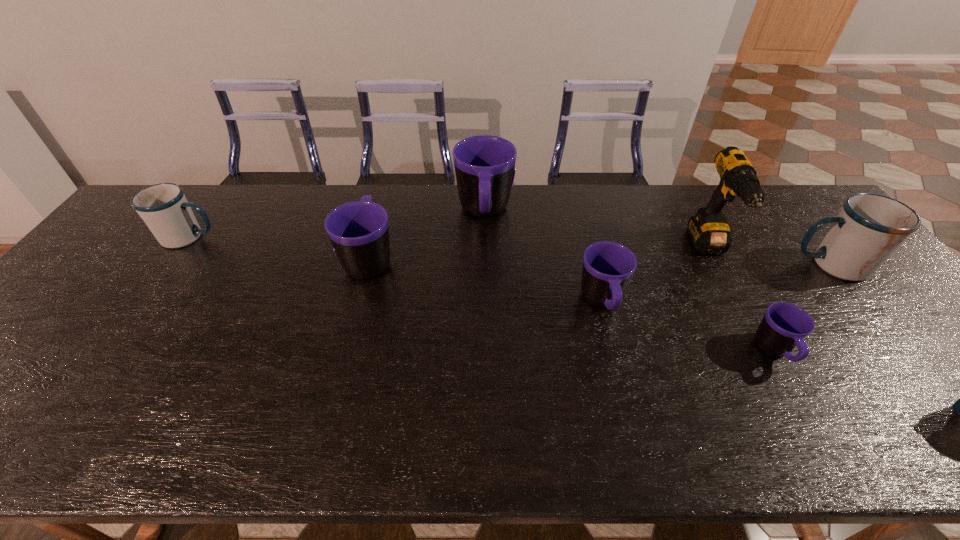
Locate which mug is the fourth closest to the leftmost object. Please provide its 2D coordinates. Your answer should be formatted as a tuple, i.e. [(x, y)], where the tuple contains the x and y coordinates of a point satisfying the conditions above.

[(784, 326)]

In order to click on the fourth closest black mug to the smaller white mug in this screenshot , I will do `click(784, 326)`.

Choose which black mug is the third nearest neighbor to the second black mug from left to right. Please provide its 2D coordinates. Your answer should be formatted as a tuple, i.e. [(x, y)], where the tuple contains the x and y coordinates of a point satisfying the conditions above.

[(784, 326)]

Locate an element on the screen. Image resolution: width=960 pixels, height=540 pixels. white mug identified as the second closest to the black drill is located at coordinates (164, 208).

Locate an element on the screen. The image size is (960, 540). the closest white mug to the fourth mug from right to left is located at coordinates (164, 208).

At what (x,y) coordinates should I click in order to perform the action: click on free space that satisfies the following two spatial constraints: 1. with the handle on the side of the fifth object from right to left; 2. on the handle side of the smaller white mug. Please return your answer as a coordinate pair (x, y). This screenshot has height=540, width=960. Looking at the image, I should click on (485, 237).